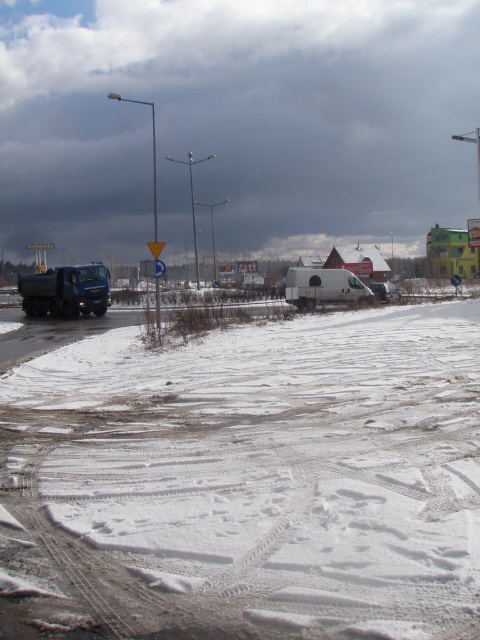
Who is more forward, (91,301) or (384,291)?

Positioned in front is point (91,301).

In the scene shown: Is matte black truck at left thinner than white matte van at center?

No, matte black truck at left is not thinner than white matte van at center.

Locate an element on the screen. The height and width of the screenshot is (640, 480). matte black truck at left is located at coordinates (66, 291).

Does white powdery snow at lower left have a smaller size compared to white matte van at center?

Incorrect, white powdery snow at lower left is not smaller in size than white matte van at center.

What do you see at coordinates (247, 481) in the screenshot? I see `white powdery snow at lower left` at bounding box center [247, 481].

Identify the location of white powdery snow at lower left. The image size is (480, 640). click(247, 481).

Between white powdery snow at lower left and matte black truck at left, which one has less height?

With less height is white powdery snow at lower left.

What do you see at coordinates (247, 481) in the screenshot?
I see `white powdery snow at lower left` at bounding box center [247, 481].

This screenshot has width=480, height=640. What are the coordinates of `white powdery snow at lower left` in the screenshot? It's located at (247, 481).